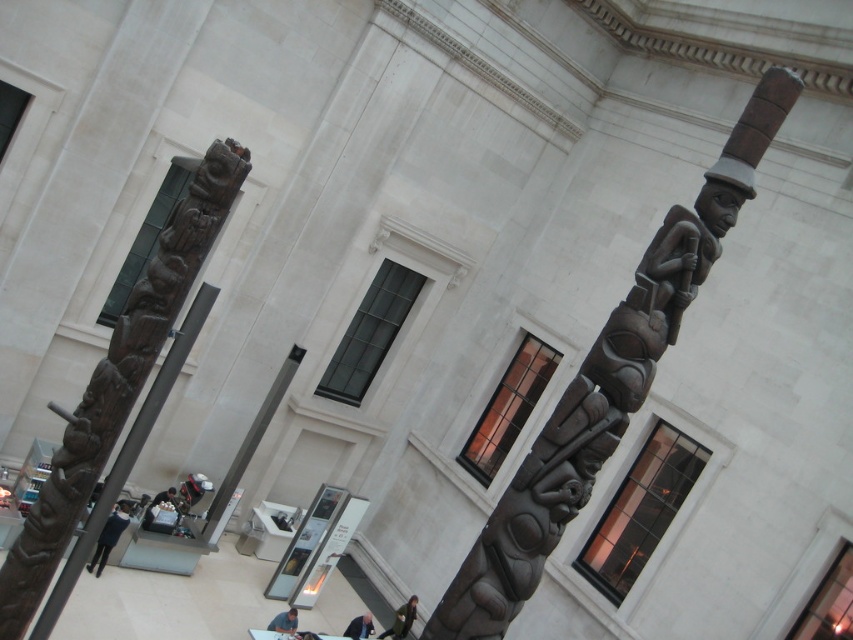
Question: Considering the real-world distances, which object is farthest from the dark brown leather jacket at lower left?

Choices:
 (A) dark brown wood totem pole at left
 (B) dark blue suit at lower center
 (C) bronze textured totem pole at center

Answer: (C)

Question: From the image, what is the correct spatial relationship of smooth gray totem pole at center in relation to dark blue jeans at lower left?

Choices:
 (A) above
 (B) below

Answer: (A)

Question: Which point is farther to the camera?

Choices:
 (A) dark blue jeans at lower left
 (B) dark blue suit at lower center

Answer: (B)

Question: Is dark brown wood totem pole at left to the left of dark blue jeans at lower left from the viewer's perspective?

Choices:
 (A) no
 (B) yes

Answer: (A)

Question: Which object is closer to the camera taking this photo?

Choices:
 (A) green fabric jacket at lower center
 (B) dark brown leather jacket at lower left
 (C) dark brown wood totem pole at left
 (D) dark blue suit at lower center

Answer: (C)

Question: Can you confirm if dark blue jeans at lower left is positioned above dark blue suit at lower center?

Choices:
 (A) no
 (B) yes

Answer: (B)